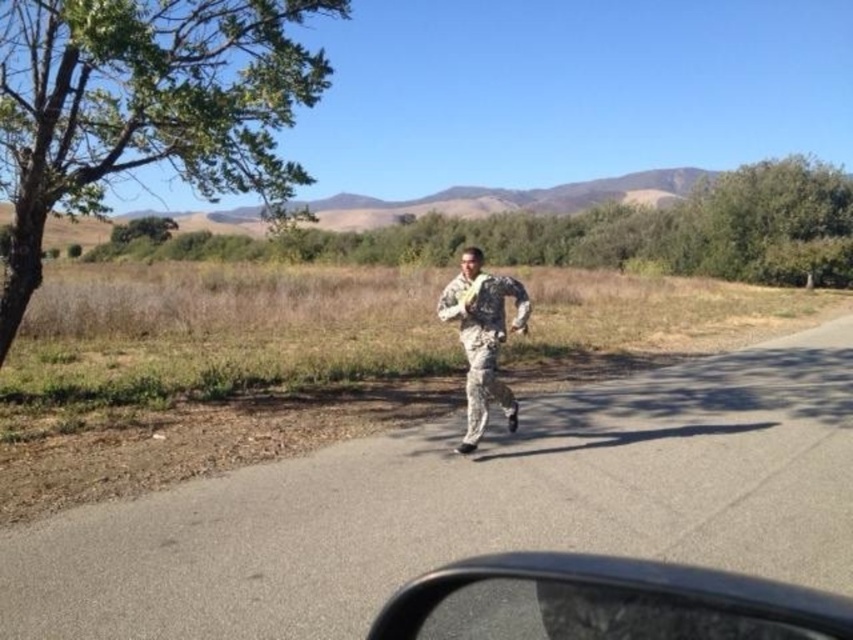
Question: Among these objects, which one is farthest from the camera?

Choices:
 (A) camouflage fabric soldier at center
 (B) transparent plastic car window at lower center

Answer: (A)

Question: Is transparent plastic car window at lower center positioned in front of camouflage fabric soldier at center?

Choices:
 (A) no
 (B) yes

Answer: (B)

Question: Which of the following is the farthest from the observer?

Choices:
 (A) (474, 291)
 (B) (676, 627)

Answer: (A)

Question: Considering the relative positions of transparent plastic car window at lower center and camouflage fabric soldier at center in the image provided, where is transparent plastic car window at lower center located with respect to camouflage fabric soldier at center?

Choices:
 (A) right
 (B) left

Answer: (A)

Question: Can you confirm if transparent plastic car window at lower center is bigger than camouflage fabric soldier at center?

Choices:
 (A) no
 (B) yes

Answer: (A)

Question: Which object appears farthest from the camera in this image?

Choices:
 (A) camouflage fabric soldier at center
 (B) transparent plastic car window at lower center

Answer: (A)